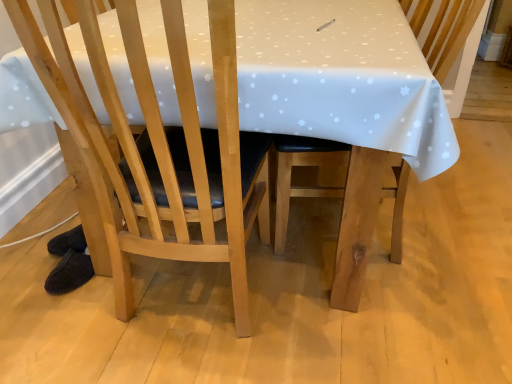
This screenshot has width=512, height=384. Find the location of `vacant area that lies in front of wooden chair at center, acting as the second chair starting from the left`. vacant area that lies in front of wooden chair at center, acting as the second chair starting from the left is located at coordinates (381, 319).